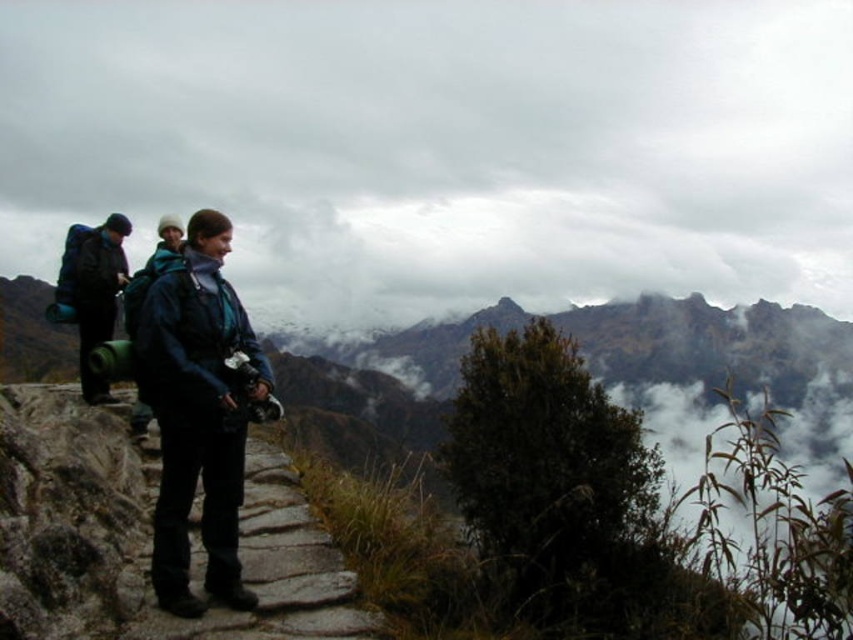
You are a hiker planning to walk along the stone paved path at center while wearing the matte blue jacket at center. Considering the space each occupies, which item takes up more area in the image?

The matte blue jacket at center takes up more area in the image than the stone paved path at center, as the stone paved path at center occupies less space than matte blue jacket at center.

Based on the scene, which object occupies a larger portion of the image between the cloudy sky at upper center and the stone paved path at center?

The cloudy sky at upper center is bigger than the stone paved path at center, so it occupies a larger portion of the image.

You are a hiker planning to take a photo of the matte blue jacket at center and the dark blue backpack at left. Which object should you focus on first if you want to capture both in the same frame without moving the camera?

You should focus on the matte blue jacket at center first because it is located below the dark blue backpack at left, so adjusting focus to the lower position will help include both in the frame.